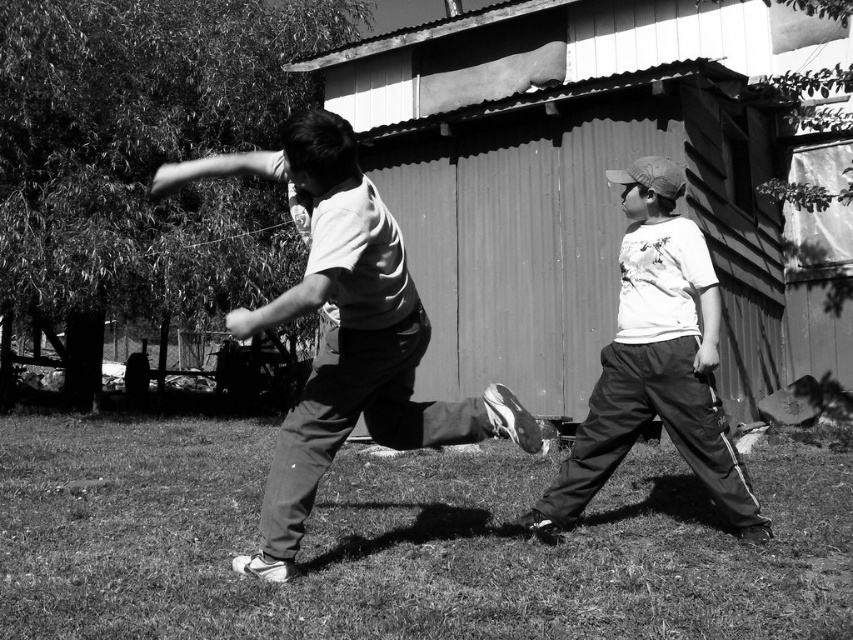
You are designing a layout for a small outdoor event and need to know the spatial relationship between the green grass at center and the matte white shirt at center. Which object is wider in the image?

The matte white shirt at center is wider than the green grass at center.

You are a photographer trying to capture a clear shot of both the matte white shirt at center and the white matte shirt at center in the scene. Since you want to ensure both subjects are in focus, you need to know which one is wider. Which one has a greater width?

The matte white shirt at center has a greater width than the white matte shirt at center according to the description.